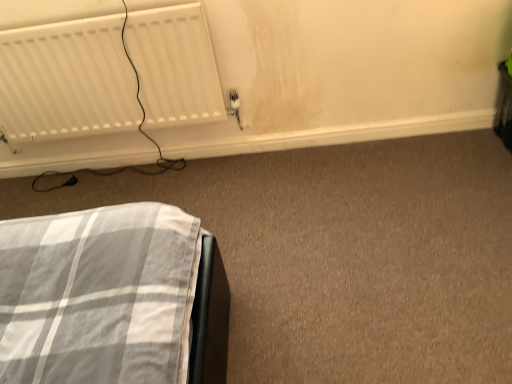
In order to click on vacant region below white matte radiator at upper left (from a real-world perspective) in this screenshot , I will do `click(124, 164)`.